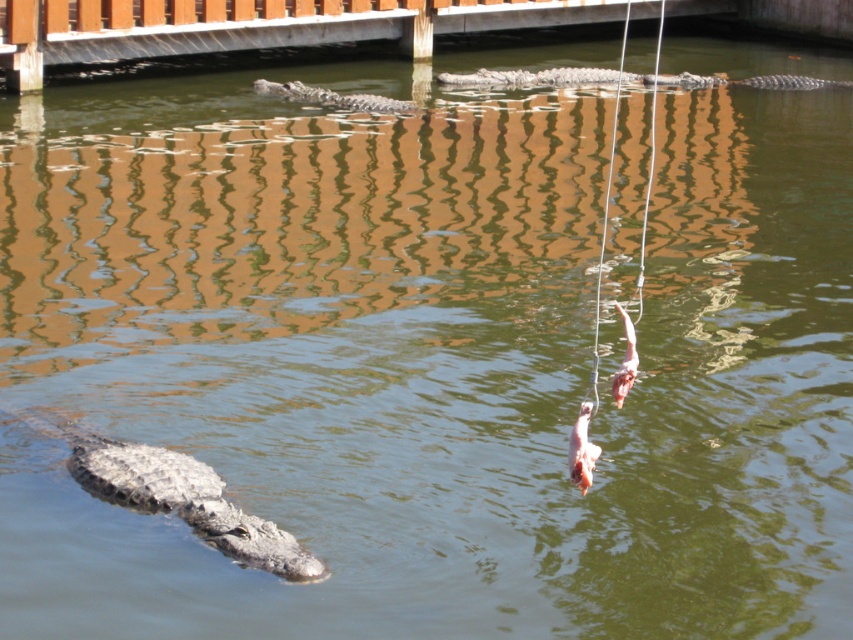
You are standing on the wooden structure in the background and want to reach the gray scaly crocodile at lower left without getting into the water. The wooden structure is at point 0.775, 0.208. Can you reach the crocodile by moving straight towards it?

The gray scaly crocodile at lower left is located at point (177,496), which is the same location as the wooden structure. Therefore, you are already at the crocodile.

You are a wildlife photographer aiming to capture images of both crocodiles in the water. Since you want to ensure the crocodiles are clearly visible in your photos, which one should you focus on first, the gray scaly crocodile at upper center or the gray textured crocodile at center?

The gray scaly crocodile at upper center is bigger than the gray textured crocodile at center, so you should focus on the gray scaly crocodile at upper center first to ensure clarity in the photo.

You are standing on the wooden structure and want to observe two points in the water, point A at coordinates point A is point (97, 476) and point B is point (550, 84). Which point is closer to you?

Point A at coordinates point (97, 476) is closer to you than point B at coordinates point (550, 84).